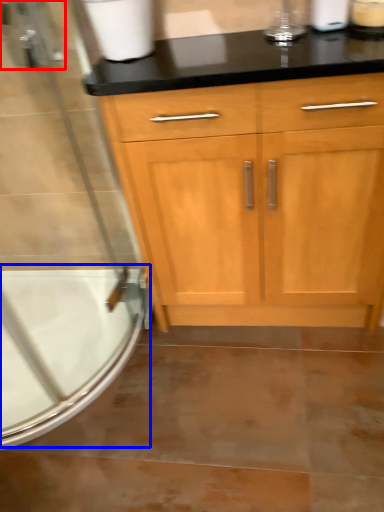
Question: Which of the following is the closest to the observer, faucet (highlighted by a red box) or bath (highlighted by a blue box)?

Choices:
 (A) faucet
 (B) bath

Answer: (A)